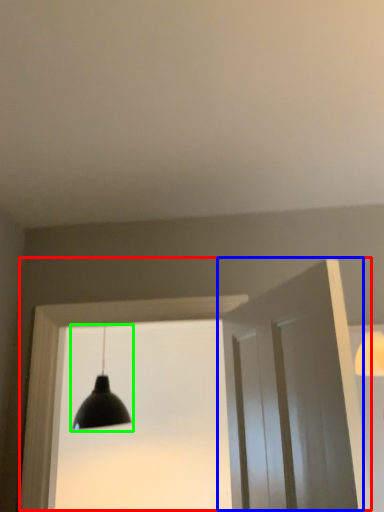
Question: Which object is positioned closest to window frame (highlighted by a red box)? Select from door (highlighted by a blue box) and lamp (highlighted by a green box).

Choices:
 (A) door
 (B) lamp

Answer: (A)